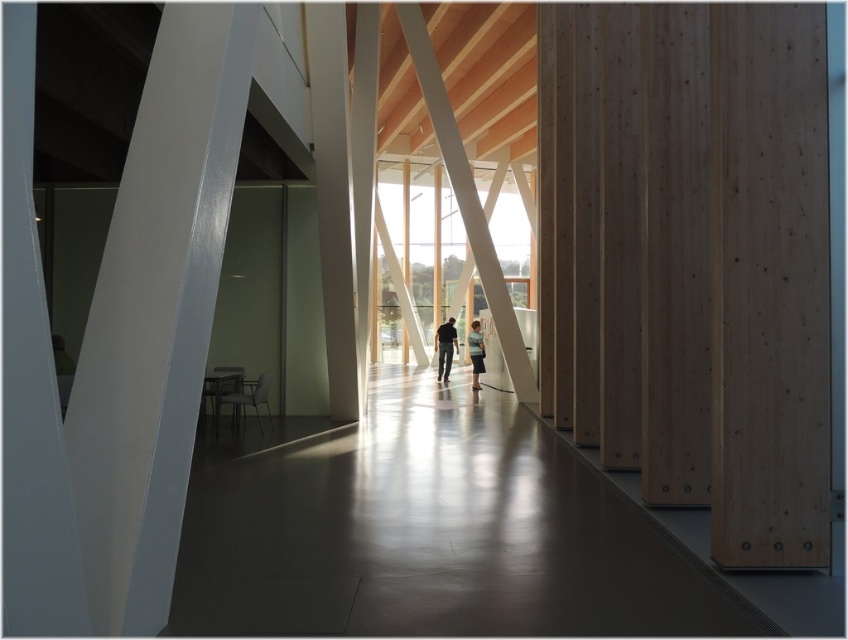
You are standing in the middle of the room and want to move towards the wall with wooden slats. Which beam, the white glossy beam at left or the light brown wooden beam at center, should you avoid walking behind to keep a clear path?

You should avoid walking behind the white glossy beam at left because it is to the left of the light brown wooden beam at center, so it would block your path towards the right side wall with wooden slats.

In the scene shown: You are standing in the modern interior space described. You notice a point marked at coordinates (155, 314). Based on the scene description, what object does this point correspond to?

The point at coordinates (155, 314) corresponds to the white glossy beam at left.